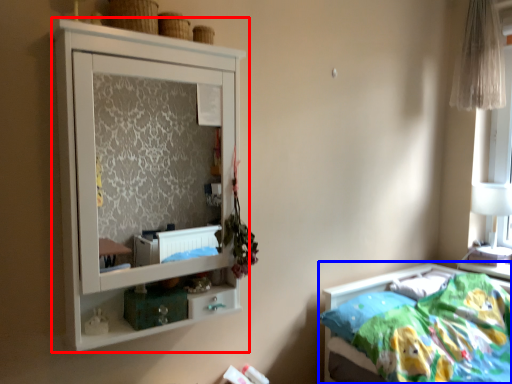
Question: Among these objects, which one is farthest to the camera, cupboard (highlighted by a red box) or bed (highlighted by a blue box)?

Choices:
 (A) cupboard
 (B) bed

Answer: (B)